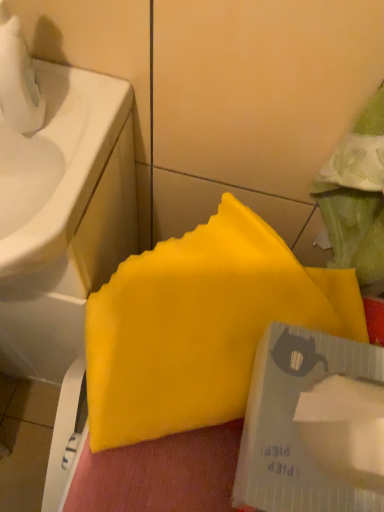
Question: Based on their sizes in the image, would you say transparent plastic tape at lower right is bigger or smaller than white glossy sink at left?

Choices:
 (A) big
 (B) small

Answer: (B)

Question: From a real-world perspective, is transparent plastic tape at lower right positioned above or below white glossy sink at left?

Choices:
 (A) above
 (B) below

Answer: (A)

Question: Considering the real-world distances, which object is closest to the yellow matte paper at center?

Choices:
 (A) transparent plastic tape at lower right
 (B) white glossy sink at left

Answer: (A)

Question: Considering the real-world distances, which object is closest to the white glossy sink at left?

Choices:
 (A) transparent plastic tape at lower right
 (B) yellow matte paper at center

Answer: (B)